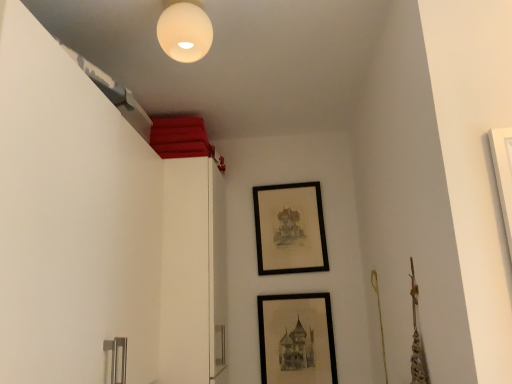
Question: Which direction should I rotate to look at black matte picture frame at lower center, which appears as the 2th picture frame when viewed from the back?

Choices:
 (A) right
 (B) left

Answer: (A)

Question: From a real-world perspective, is black matte picture frame at lower center, which is the first picture frame in bottom-to-top order, positioned over black matte picture frame at upper center, which is the first picture frame in back-to-front order, based on gravity?

Choices:
 (A) no
 (B) yes

Answer: (A)

Question: Are black matte picture frame at lower center, which is the first picture frame in bottom-to-top order, and black matte picture frame at upper center, marked as the 1th picture frame in a top-to-bottom arrangement, beside each other?

Choices:
 (A) no
 (B) yes

Answer: (A)

Question: Is black matte picture frame at lower center, the first picture frame positioned from the front, looking in the opposite direction of black matte picture frame at upper center, marked as the 1th picture frame in a top-to-bottom arrangement?

Choices:
 (A) yes
 (B) no

Answer: (B)

Question: From the image's perspective, is black matte picture frame at lower center, which appears as the second picture frame when viewed from the top, on top of black matte picture frame at upper center, which is the first picture frame in back-to-front order?

Choices:
 (A) yes
 (B) no

Answer: (B)

Question: From the image's perspective, is black matte picture frame at lower center, which appears as the second picture frame when viewed from the top, below black matte picture frame at upper center, which appears as the second picture frame when viewed from the front?

Choices:
 (A) yes
 (B) no

Answer: (A)

Question: Considering the relative sizes of black matte picture frame at lower center, the first picture frame positioned from the front, and black matte picture frame at upper center, which is the first picture frame in back-to-front order, in the image provided, is black matte picture frame at lower center, the first picture frame positioned from the front, shorter than black matte picture frame at upper center, which is the first picture frame in back-to-front order,?

Choices:
 (A) yes
 (B) no

Answer: (A)

Question: From the image's perspective, is white matte sphere at upper center located beneath black matte picture frame at upper center, which is the first picture frame in back-to-front order?

Choices:
 (A) no
 (B) yes

Answer: (A)

Question: Is black matte picture frame at upper center, which is the first picture frame in back-to-front order, at the back of white matte sphere at upper center?

Choices:
 (A) no
 (B) yes

Answer: (B)

Question: Does white matte sphere at upper center have a greater width compared to black matte picture frame at upper center, which appears as the second picture frame when viewed from the front?

Choices:
 (A) no
 (B) yes

Answer: (B)

Question: From a real-world perspective, does white matte sphere at upper center stand above black matte picture frame at upper center, which is the first picture frame in back-to-front order?

Choices:
 (A) yes
 (B) no

Answer: (A)

Question: Are white matte sphere at upper center and black matte picture frame at upper center, which is the first picture frame in back-to-front order, making contact?

Choices:
 (A) no
 (B) yes

Answer: (A)

Question: From the image's perspective, is white matte sphere at upper center over black matte picture frame at upper center, which is the first picture frame in back-to-front order?

Choices:
 (A) no
 (B) yes

Answer: (B)

Question: Can you confirm if black matte picture frame at lower center, which appears as the 2th picture frame when viewed from the back, is thinner than white matte sphere at upper center?

Choices:
 (A) yes
 (B) no

Answer: (A)